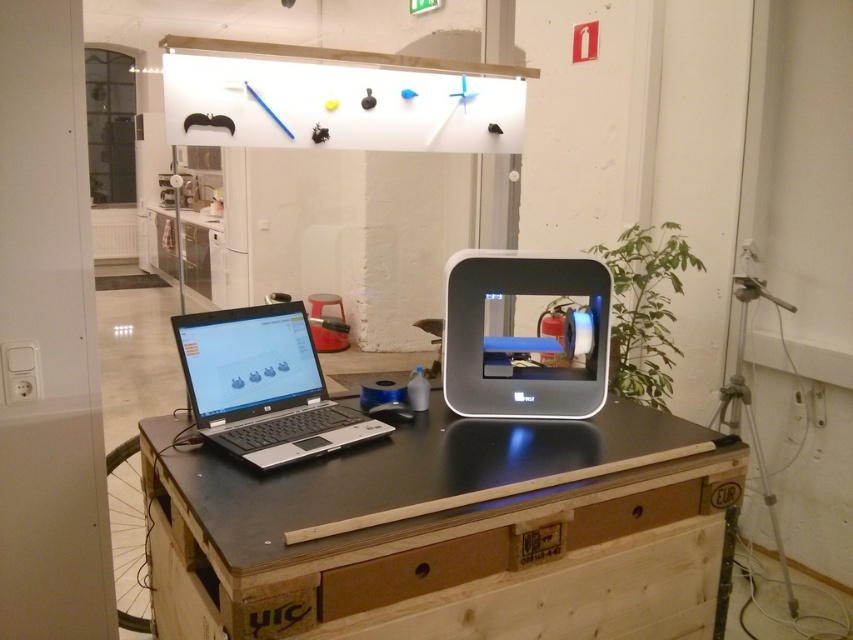
Who is more distant from viewer, (252,451) or (688,500)?

The point (688,500) is more distant.

Is point (207, 401) positioned before point (572, 529)?

No, (207, 401) is behind (572, 529).

Who is more distant from viewer, (190, 403) or (602, 508)?

The point (190, 403) is more distant.

Locate an element on the screen. black matte laptop at left is located at coordinates (263, 387).

Between black matte table at center and wooden drawer at lower center, which one appears on the right side from the viewer's perspective?

Positioned to the right is wooden drawer at lower center.

The image size is (853, 640). Describe the element at coordinates (442, 531) in the screenshot. I see `black matte table at center` at that location.

Is point (666, 426) positioned behind point (695, 477)?

Yes, point (666, 426) is behind point (695, 477).

You are a GUI agent. You are given a task and a screenshot of the screen. Output one action in this format:
    pyautogui.click(x=<x>, y=<y>)
    Task: Click on the black matte table at center
    The image size is (853, 640).
    Given the screenshot: What is the action you would take?
    pyautogui.click(x=442, y=531)

Between black matte table at center and wooden drawer at center, which one has more height?

With more height is black matte table at center.

Where is `black matte table at center`? black matte table at center is located at coordinates (442, 531).